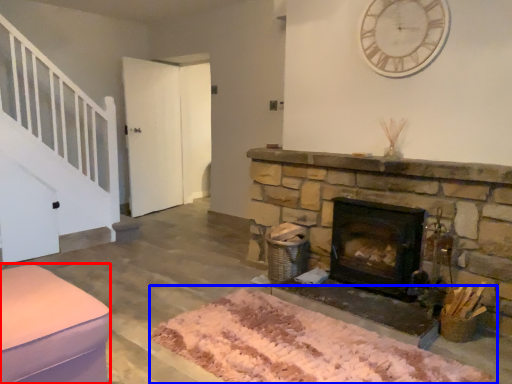
Question: Which object appears farthest to the camera in this image, furniture (highlighted by a red box) or mat (highlighted by a blue box)?

Choices:
 (A) furniture
 (B) mat

Answer: (A)